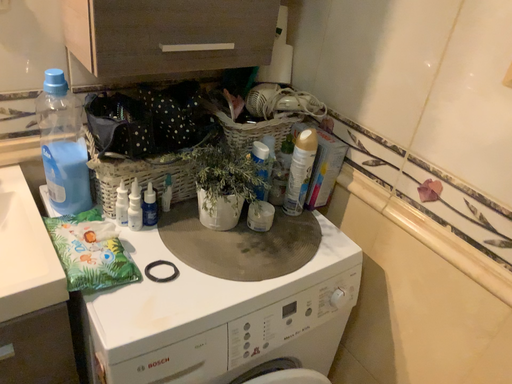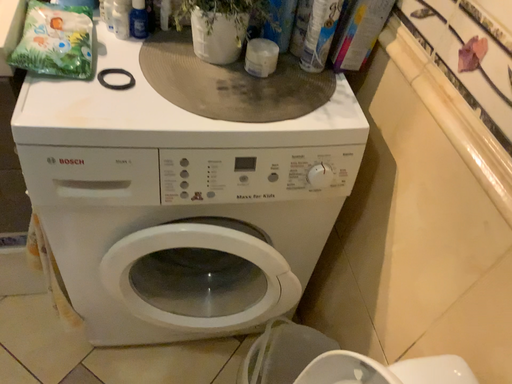
Question: Which way did the camera rotate in the video?

Choices:
 (A) rotated downward
 (B) rotated upward

Answer: (A)